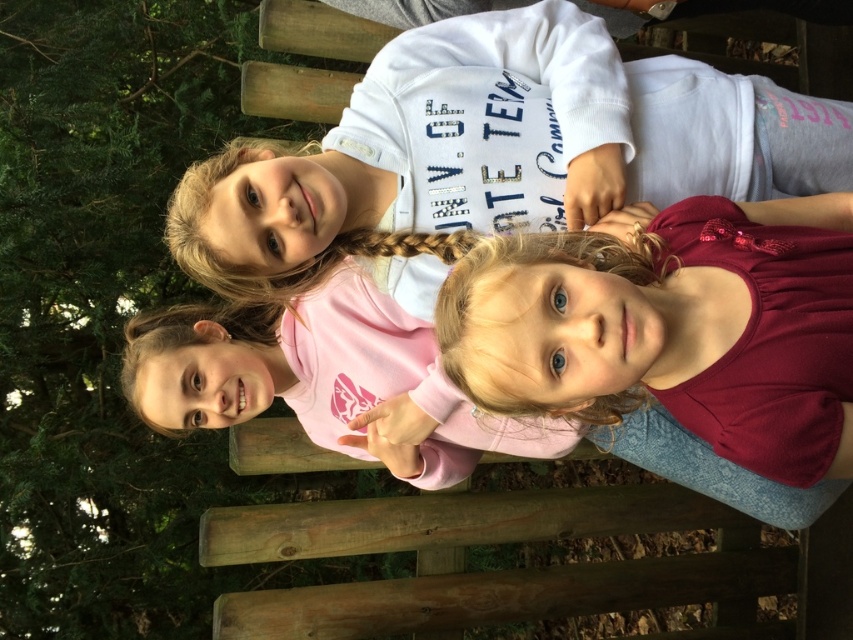
You are a photographer standing 10 feet away from the subjects. You want to take a closeup shot of the white cotton shirt at upper center and the pink matte shirt at center. Given their distance from each other, will you need to adjust your camera focus to capture both clearly in the same frame?

The white cotton shirt at upper center is 11.86 inches away from the pink matte shirt at center. Since they are only about a foot apart, you can capture both clearly in the same frame without needing to adjust the focus significantly.

You are standing 2 meters away from the wooden fence in the image. There is a point marked at coordinates point (509, 84). Can you reach this point with your outstretched hand without moving your feet?

The distance of point (509, 84) from viewer is 1.61 meters. Since you are standing 2 meters away from the wooden fence, the point is closer than your current position. However, reaching it would require moving towards the fence, so you cannot reach it without moving your feet.